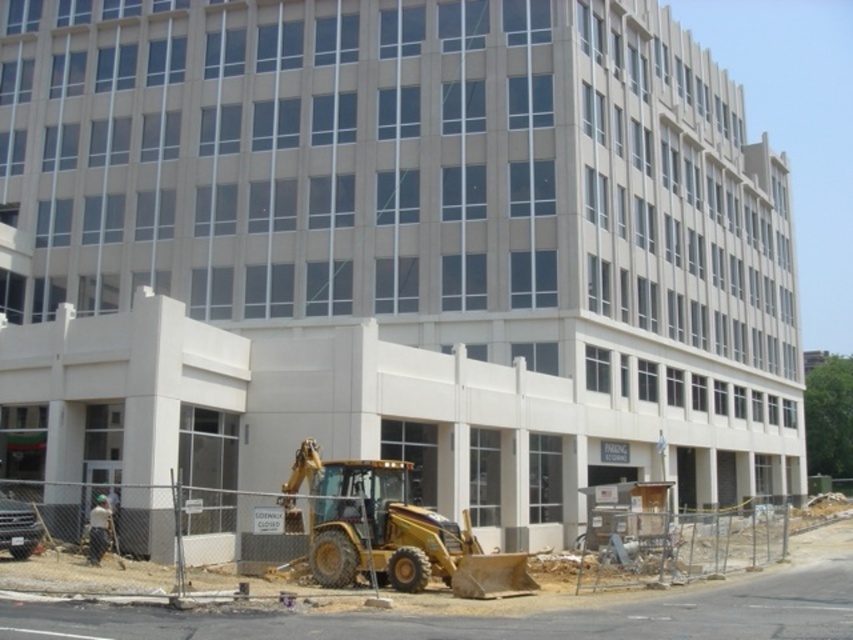
Between yellow metallic backhoe at lower center and yellow metallic excavator at lower center, which one appears on the right side from the viewer's perspective?

From the viewer's perspective, yellow metallic backhoe at lower center appears more on the right side.

The height and width of the screenshot is (640, 853). What do you see at coordinates (405, 602) in the screenshot?
I see `yellow metallic backhoe at lower center` at bounding box center [405, 602].

The image size is (853, 640). What are the coordinates of `yellow metallic backhoe at lower center` in the screenshot? It's located at (405, 602).

Measure the distance between yellow metallic backhoe at lower center and camera.

They are 14.44 meters apart.

Can you confirm if yellow metallic backhoe at lower center is shorter than white fabric construction worker at lower left?

No, yellow metallic backhoe at lower center is not shorter than white fabric construction worker at lower left.

Between point (73, 493) and point (91, 540), which one is positioned behind?

Positioned behind is point (73, 493).

Where is `yellow metallic backhoe at lower center`? Image resolution: width=853 pixels, height=640 pixels. yellow metallic backhoe at lower center is located at coordinates (405, 602).

Is yellow metallic excavator at lower center wider than white fabric construction worker at lower left?

No, yellow metallic excavator at lower center is not wider than white fabric construction worker at lower left.

Who is lower down, yellow metallic excavator at lower center or white fabric construction worker at lower left?

Positioned lower is white fabric construction worker at lower left.

Who is more forward, (442, 545) or (99, 493)?

Point (442, 545) is in front.

Where is `yellow metallic excavator at lower center`? yellow metallic excavator at lower center is located at coordinates (387, 531).